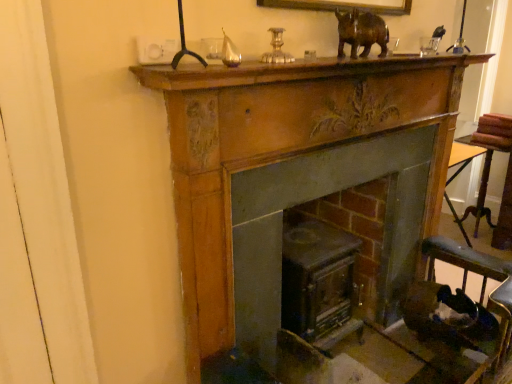
Identify the location of free space above wooden fireplace at center, placed as the 1th fireplace when sorted from right to left (from a real-world perspective). (339, 82).